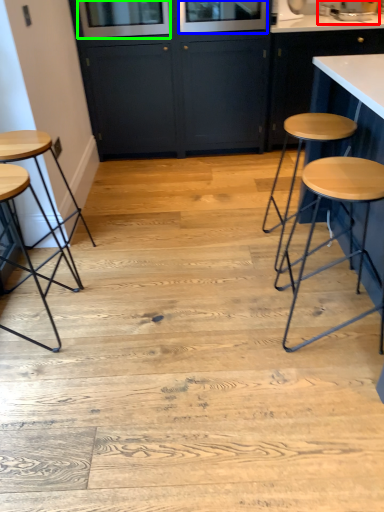
Question: Estimate the real-world distances between objects in this image. Which object is closer to sink (highlighted by a red box), window screen (highlighted by a blue box) or window screen (highlighted by a green box)?

Choices:
 (A) window screen
 (B) window screen

Answer: (A)